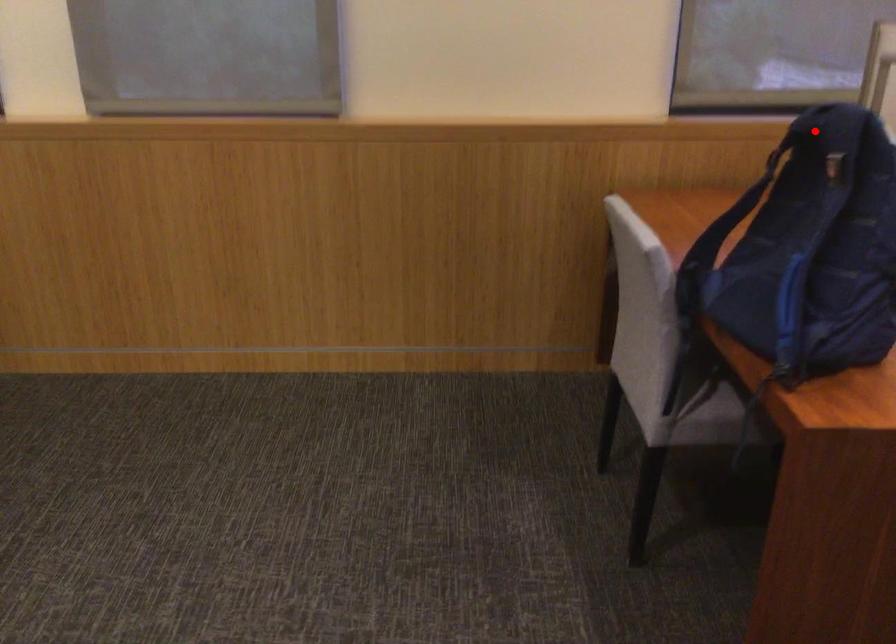
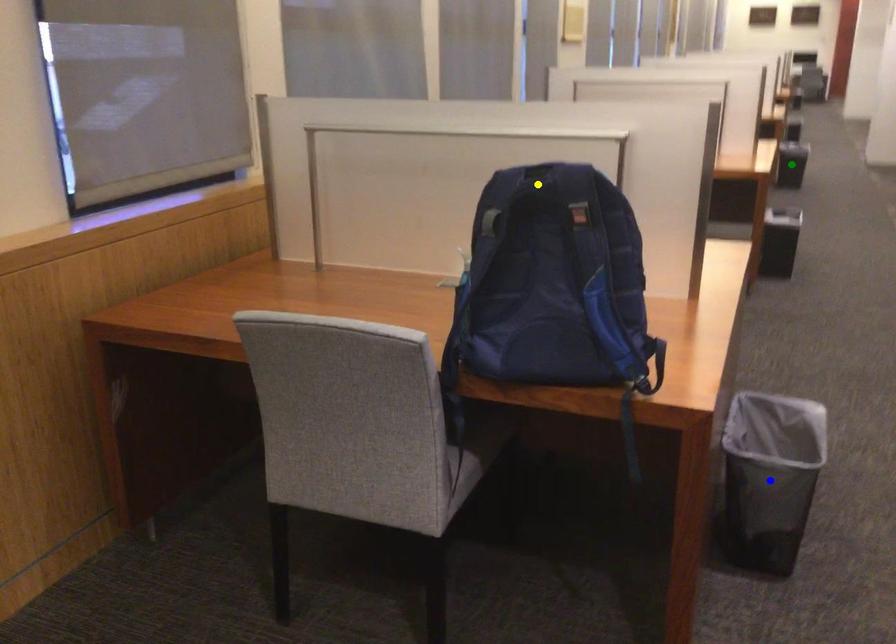
Question: I am providing you with two images of the same scene from different viewpoints. A red point is marked on the first image. You are given multiple points on the second image. Which point in image 2 represents the same 3d spot as the red point in image 1?

Choices:
 (A) blue point
 (B) yellow point
 (C) green point

Answer: (B)